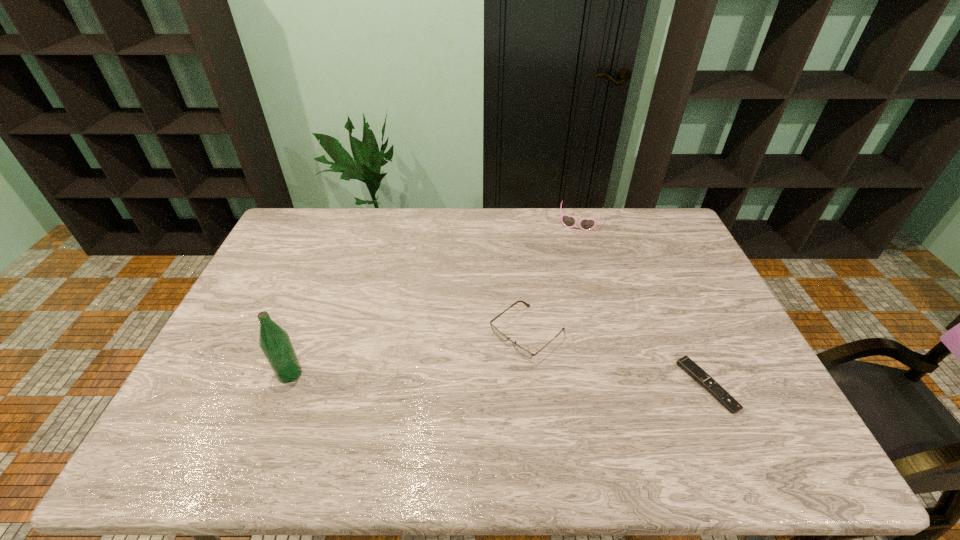
The image size is (960, 540). In order to click on free space located on the front-facing side of the third shortest object in this screenshot , I will do `click(558, 299)`.

Locate an element on the screen. The image size is (960, 540). vacant space located on the front-facing side of the third shortest object is located at coordinates (566, 267).

Where is `vacant space positioned on the front-facing side of the third shortest object`? Image resolution: width=960 pixels, height=540 pixels. vacant space positioned on the front-facing side of the third shortest object is located at coordinates (560, 291).

Identify the location of vacant region located on the front-facing side of the second shortest object. (456, 392).

Find the location of `free space located 0.180m on the front-facing side of the second shortest object`. free space located 0.180m on the front-facing side of the second shortest object is located at coordinates (453, 394).

You are a GUI agent. You are given a task and a screenshot of the screen. Output one action in this format:
    pyautogui.click(x=<x>, y=<y>)
    Task: Click on the free space located on the front-facing side of the second shortest object
    This screenshot has width=960, height=540.
    Given the screenshot: What is the action you would take?
    pyautogui.click(x=479, y=374)

Find the location of `object at the far edge`. object at the far edge is located at coordinates (585, 224).

Identify the location of object at the near edge. (685, 363).

At what (x,y) coordinates should I click in order to perform the action: click on object situated at the right edge. Please return your answer as a coordinate pair (x, y). The width and height of the screenshot is (960, 540). Looking at the image, I should click on (685, 363).

This screenshot has width=960, height=540. In order to click on object located in the near right corner section of the desktop in this screenshot , I will do `click(685, 363)`.